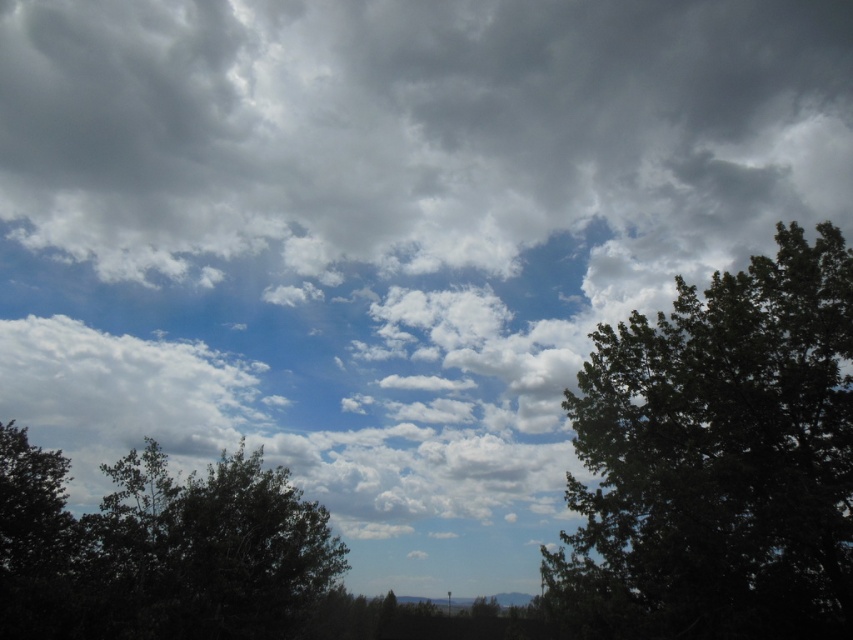
Question: Which of the following is the farthest from the observer?

Choices:
 (A) green leafy tree at right
 (B) dark green leafy tree at lower left
 (C) gray fluffy cloud at upper center

Answer: (C)

Question: Is gray fluffy cloud at upper center in front of green leafy tree at right?

Choices:
 (A) no
 (B) yes

Answer: (A)

Question: Is gray fluffy cloud at upper center below dark green leafy tree at lower left?

Choices:
 (A) yes
 (B) no

Answer: (B)

Question: Is gray fluffy cloud at upper center to the left of dark green leafy tree at lower left from the viewer's perspective?

Choices:
 (A) no
 (B) yes

Answer: (A)

Question: Considering the real-world distances, which object is closest to the green leafy tree at right?

Choices:
 (A) gray fluffy cloud at upper center
 (B) dark green leafy tree at lower left

Answer: (B)

Question: Based on their relative distances, which object is farther from the dark green leafy tree at lower left?

Choices:
 (A) gray fluffy cloud at upper center
 (B) green leafy tree at right

Answer: (A)